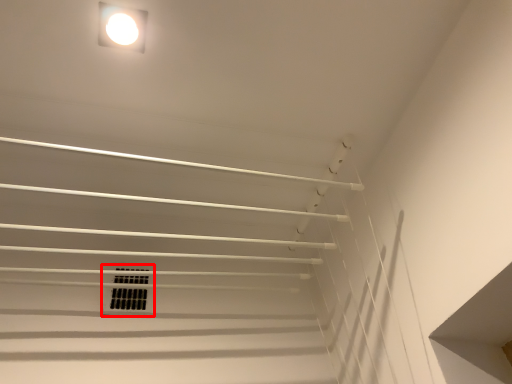
Question: Considering the relative positions of window (annotated by the red box) and lamp in the image provided, where is window (annotated by the red box) located with respect to the staircase?

Choices:
 (A) right
 (B) left

Answer: (B)